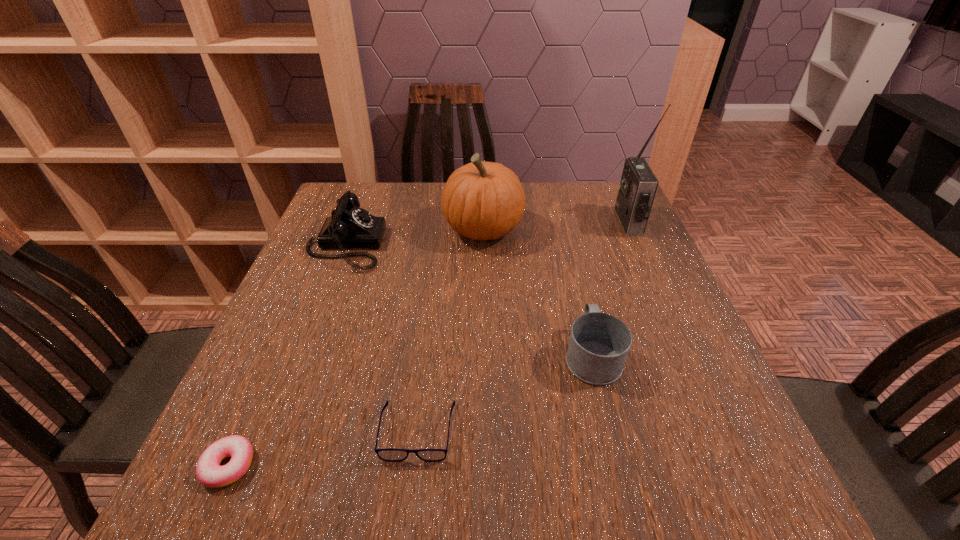
Find the location of a particular element. radio receiver is located at coordinates (638, 185).

The image size is (960, 540). I want to click on the rightmost object, so click(638, 185).

Where is `the fifth shortest object`? the fifth shortest object is located at coordinates (481, 200).

You are a GUI agent. You are given a task and a screenshot of the screen. Output one action in this format:
    pyautogui.click(x=<x>, y=<y>)
    Task: Click on the telephone
    The width and height of the screenshot is (960, 540).
    Given the screenshot: What is the action you would take?
    pyautogui.click(x=349, y=226)

In order to click on mug in this screenshot , I will do `click(599, 343)`.

Where is `the fourth farthest object`? The image size is (960, 540). the fourth farthest object is located at coordinates (599, 343).

Find the location of a particular element. spectacles is located at coordinates (391, 455).

Locate an element on the screen. The image size is (960, 540). the shortest object is located at coordinates (209, 472).

Locate an element on the screen. Image resolution: width=960 pixels, height=540 pixels. vacant region located on the display of the tallest object is located at coordinates (594, 222).

I want to click on vacant space located 0.280m on the display of the tallest object, so click(518, 222).